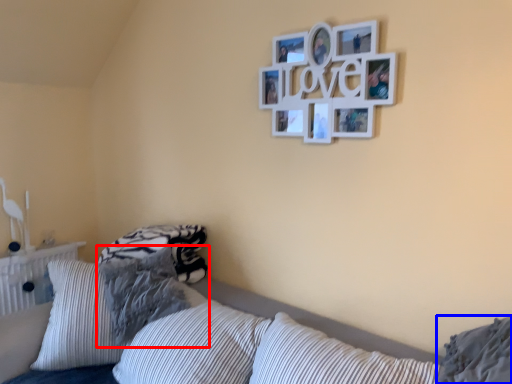
Question: Which object appears closest to the camera in this image, pillow (highlighted by a red box) or pillow (highlighted by a blue box)?

Choices:
 (A) pillow
 (B) pillow

Answer: (B)